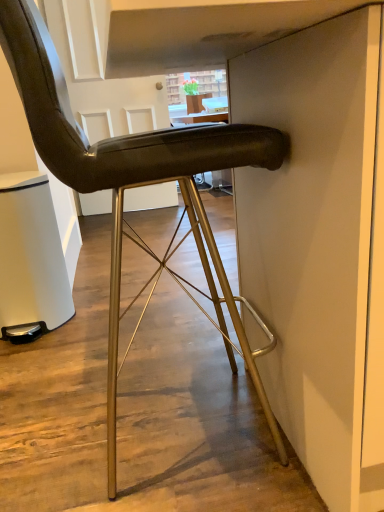
Question: Considering the positions of matte black chair at center and white matte trash can at lower left in the image, is matte black chair at center wider or thinner than white matte trash can at lower left?

Choices:
 (A) wide
 (B) thin

Answer: (A)

Question: Is matte black chair at center spatially inside white matte trash can at lower left, or outside of it?

Choices:
 (A) inside
 (B) outside

Answer: (B)

Question: From the image's perspective, is matte black chair at center positioned above or below white matte trash can at lower left?

Choices:
 (A) above
 (B) below

Answer: (A)

Question: Is white matte trash can at lower left bigger or smaller than matte black chair at center?

Choices:
 (A) small
 (B) big

Answer: (A)

Question: From the image's perspective, is white matte trash can at lower left located above or below matte black chair at center?

Choices:
 (A) above
 (B) below

Answer: (B)

Question: Is white matte trash can at lower left in front of or behind matte black chair at center in the image?

Choices:
 (A) behind
 (B) front

Answer: (A)

Question: Is point (59, 302) positioned closer to the camera than point (165, 268)?

Choices:
 (A) farther
 (B) closer

Answer: (A)